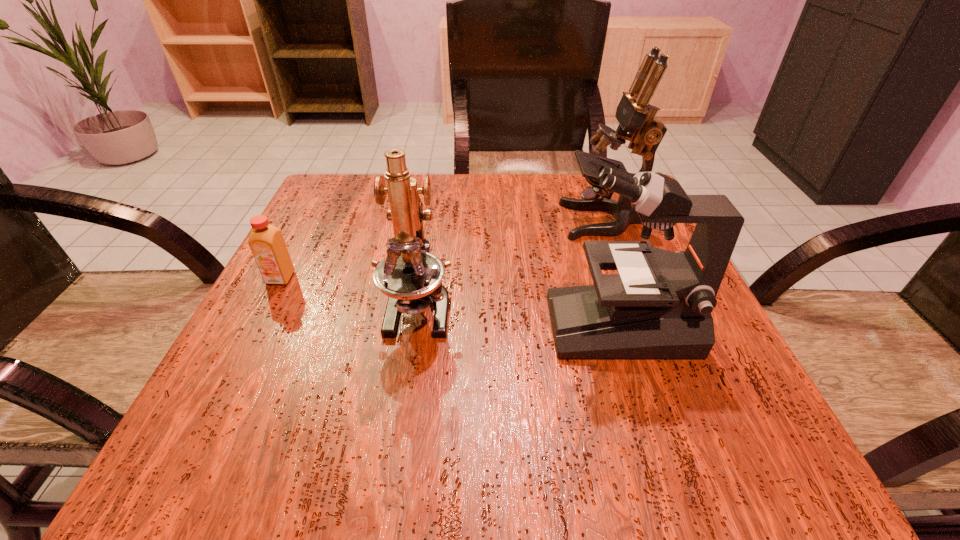
The height and width of the screenshot is (540, 960). I want to click on the farthest object, so click(635, 115).

Locate an element on the screen. The height and width of the screenshot is (540, 960). the leftmost microscope is located at coordinates (410, 276).

Locate an element on the screen. the leftmost object is located at coordinates [266, 242].

Image resolution: width=960 pixels, height=540 pixels. I want to click on orange juice, so click(266, 242).

Locate an element on the screen. The height and width of the screenshot is (540, 960). vacant position located 0.050m at the eyepieces of the farthest object is located at coordinates (540, 220).

At what (x,y) coordinates should I click in order to perform the action: click on free spot located at the eyepieces of the farthest object. Please return your answer as a coordinate pair (x, y). Looking at the image, I should click on (476, 220).

The height and width of the screenshot is (540, 960). What are the coordinates of `vacant space located at the eyepieces of the farthest object` in the screenshot? It's located at click(448, 220).

Where is `free space located 0.060m at the eyepiece of the third object from right to left`? free space located 0.060m at the eyepiece of the third object from right to left is located at coordinates (407, 381).

Where is `vacant space situated 0.130m on the front and back of the orange juice`? The height and width of the screenshot is (540, 960). vacant space situated 0.130m on the front and back of the orange juice is located at coordinates (248, 341).

Identify the location of object at the far edge. Image resolution: width=960 pixels, height=540 pixels. (635, 115).